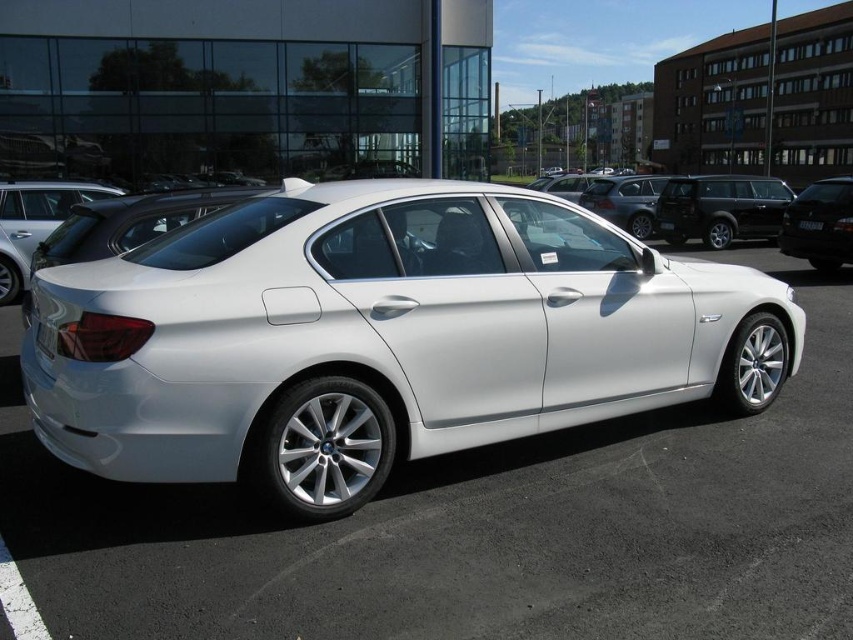
Question: Is shiny black suv at center in front of black plastic license plate at center?

Choices:
 (A) no
 (B) yes

Answer: (A)

Question: Among these points, which one is farthest from the camera?

Choices:
 (A) (595, 424)
 (B) (720, 236)
 (C) (805, 220)

Answer: (B)

Question: From the image, what is the correct spatial relationship of shiny black suv at center in relation to satin black sedan at right?

Choices:
 (A) left
 (B) right

Answer: (B)

Question: Based on their relative distances, which object is farther from the satin silver sedan at rear?

Choices:
 (A) satin black sedan at right
 (B) black plastic license plate at center
 (C) white metallic sedan at center
 (D) white metallic license plate at center

Answer: (D)

Question: Can you confirm if shiny black suv at center is wider than black plastic license plate at center?

Choices:
 (A) no
 (B) yes

Answer: (B)

Question: Which point is closer to the camera?

Choices:
 (A) satin silver sedan at rear
 (B) white metallic car at center
 (C) black plastic license plate at center

Answer: (B)